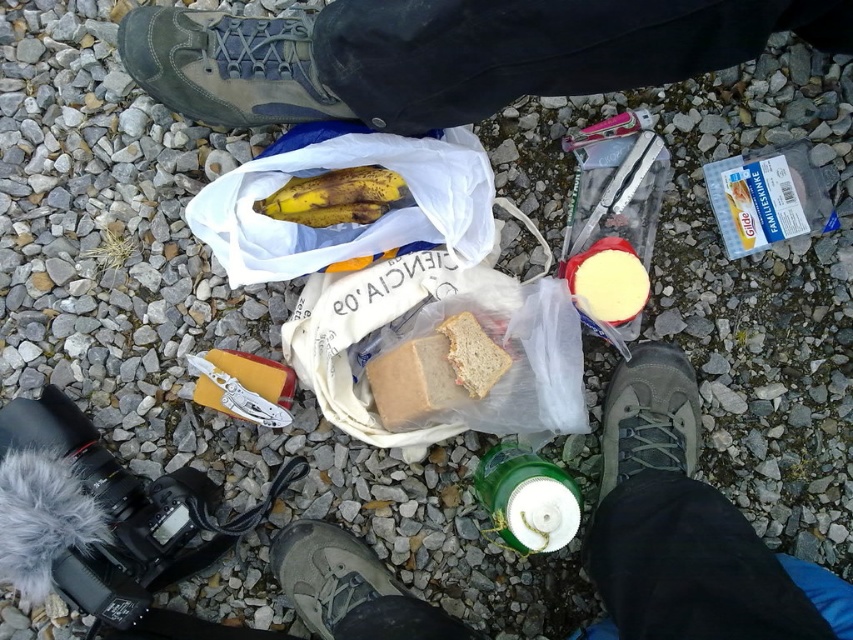
You are planning to pack a picnic basket and need to know the relative sizes of the items. Based on the image, which item is shorter between the yellow cheese at center and the slightly toasted bread at center?

The yellow cheese at center is shorter than the slightly toasted bread at center.

You are a photographer trying to capture the slightly toasted bread at center without the matte gray shoe at lower center blocking the view. Can you adjust your position to do so?

The matte gray shoe at lower center is positioned under the slightly toasted bread at center, so moving the camera slightly upward or shifting your position to the side would allow you to frame the slightly toasted bread at center without obstruction from the shoe.